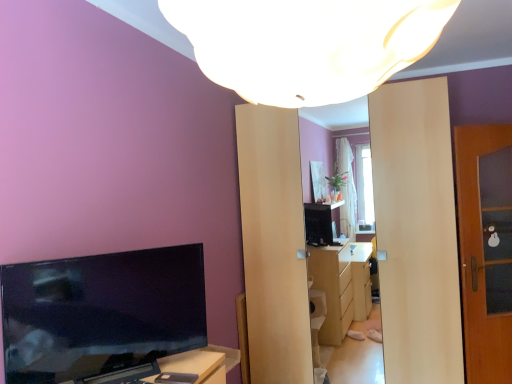
Describe the element at coordinates (485, 248) in the screenshot. I see `wooden door at right` at that location.

Identify the location of wooden door at right. (485, 248).

The image size is (512, 384). Describe the element at coordinates (176, 378) in the screenshot. I see `black matte mobile phone at lower center` at that location.

Identify the location of wooden door at right. (485, 248).

Is wooden door at right touching black glossy tv at left?

They are not placed beside each other.

Would you say wooden door at right is inside or outside black glossy tv at left?

wooden door at right lies outside black glossy tv at left.

From the image's perspective, is wooden door at right under black glossy tv at left?

Incorrect, from the image's perspective, wooden door at right is higher than black glossy tv at left.

From a real-world perspective, is white matte lampshade at upper center on black glossy tv at left?

Yes, from a real-world perspective, white matte lampshade at upper center is over black glossy tv at left

How many degrees apart are the facing directions of white matte lampshade at upper center and black glossy tv at left?

They differ by 126 degrees in their facing directions.

From the image's perspective, is white matte lampshade at upper center located above or below black glossy tv at left?

white matte lampshade at upper center is above black glossy tv at left.

Find the location of a particular element. Image resolution: width=512 pixels, height=384 pixels. lamp lying on the left of wooden door at right is located at coordinates (307, 44).

From their relative heights in the image, would you say wooden door at right is taller or shorter than white matte lampshade at upper center?

wooden door at right is taller than white matte lampshade at upper center.

From a real-world perspective, is wooden door at right physically above white matte lampshade at upper center?

No, from a real-world perspective, wooden door at right is not on top of white matte lampshade at upper center.

Does wooden door at right turn towards white matte lampshade at upper center?

No.

Can you confirm if white matte lampshade at upper center is smaller than wooden door at right?

No, white matte lampshade at upper center is not smaller than wooden door at right.

Looking at their sizes, would you say white matte lampshade at upper center is wider or thinner than wooden door at right?

Considering their sizes, white matte lampshade at upper center looks broader than wooden door at right.

Is white matte lampshade at upper center touching wooden door at right?

No, white matte lampshade at upper center is not touching wooden door at right.

From a real-world perspective, is white matte lampshade at upper center located beneath wooden door at right?

No.

From a real-world perspective, which object stands above the other?

black glossy tv at left is physically above.

Does black glossy tv at left have a lesser height compared to wooden door at right?

Yes.

Is black glossy tv at left positioned with its back to wooden door at right?

No, black glossy tv at left's orientation is not away from wooden door at right.

Which point is more distant from viewer, (181,374) or (404,66)?

The point (181,374) is more distant.

From the image's perspective, which is below, black matte mobile phone at lower center or white matte lampshade at upper center?

black matte mobile phone at lower center is shown below in the image.

Does black matte mobile phone at lower center turn towards white matte lampshade at upper center?

No, black matte mobile phone at lower center does not turn towards white matte lampshade at upper center.

Between black matte mobile phone at lower center and white matte lampshade at upper center, which one has smaller size?

black matte mobile phone at lower center.

Is black glossy tv at left thinner than black matte mobile phone at lower center?

Indeed, black glossy tv at left has a lesser width compared to black matte mobile phone at lower center.

Which object is more forward, black glossy tv at left or black matte mobile phone at lower center?

black glossy tv at left is more forward.

Is black glossy tv at left bigger or smaller than black matte mobile phone at lower center?

black glossy tv at left is bigger than black matte mobile phone at lower center.

Where is `television that appears above the black matte mobile phone at lower center (from the image's perspective)`? This screenshot has width=512, height=384. television that appears above the black matte mobile phone at lower center (from the image's perspective) is located at coordinates (101, 313).

Locate an element on the screen. This screenshot has height=384, width=512. television lying in front of the wooden door at right is located at coordinates (101, 313).

Where is `lamp above the black glossy tv at left (from the image's perspective)`? The height and width of the screenshot is (384, 512). lamp above the black glossy tv at left (from the image's perspective) is located at coordinates (307, 44).

Based on their spatial positions, is white matte lampshade at upper center or black matte mobile phone at lower center closer to black glossy tv at left?

Based on the image, black matte mobile phone at lower center appears to be nearer to black glossy tv at left.

Considering their positions, is wooden door at right positioned closer to white matte lampshade at upper center than black matte mobile phone at lower center?

The object closer to white matte lampshade at upper center is black matte mobile phone at lower center.

Which object lies further to the anchor point black matte mobile phone at lower center, wooden door at right or black glossy tv at left?

wooden door at right.

Considering their positions, is black glossy tv at left positioned closer to white matte lampshade at upper center than wooden door at right?

Among the two, black glossy tv at left is located nearer to white matte lampshade at upper center.

When comparing their distances from wooden door at right, does black glossy tv at left or white matte lampshade at upper center seem further?

Based on the image, white matte lampshade at upper center appears to be further to wooden door at right.

Which object lies further to the anchor point wooden door at right, white matte lampshade at upper center or black glossy tv at left?

Among the two, white matte lampshade at upper center is located further to wooden door at right.

From the image, which object appears to be nearer to black glossy tv at left, black matte mobile phone at lower center or white matte lampshade at upper center?

The object closer to black glossy tv at left is black matte mobile phone at lower center.

Looking at the image, which one is located further to wooden door at right, black glossy tv at left or black matte mobile phone at lower center?

black matte mobile phone at lower center lies further to wooden door at right than the other object.

This screenshot has width=512, height=384. What are the coordinates of `television between white matte lampshade at upper center and wooden door at right from front to back` in the screenshot? It's located at (101, 313).

At what (x,y) coordinates should I click in order to perform the action: click on television located between white matte lampshade at upper center and black matte mobile phone at lower center in the depth direction. Please return your answer as a coordinate pair (x, y). This screenshot has height=384, width=512. Looking at the image, I should click on (101, 313).

Identify the location of mobile phone between black glossy tv at left and wooden door at right from left to right. The image size is (512, 384). (176, 378).

You are a GUI agent. You are given a task and a screenshot of the screen. Output one action in this format:
    pyautogui.click(x=<x>, y=<y>)
    Task: Click on the mobile phone between white matte lampshade at upper center and wooden door at right from front to back
    
    Given the screenshot: What is the action you would take?
    pyautogui.click(x=176, y=378)